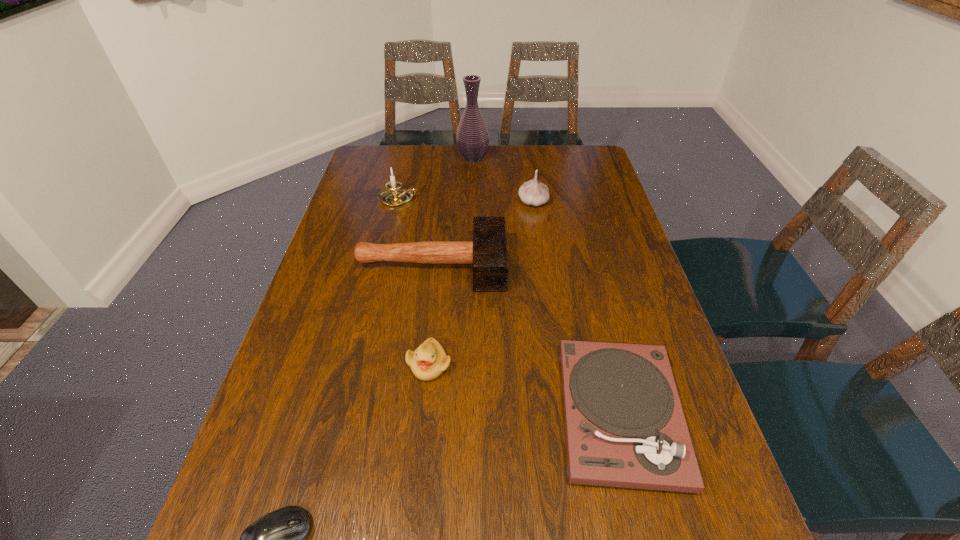
Identify the location of blank space located on the hammer head face of the mallet. (552, 265).

Find the location of `vacant space located on the front-facing side of the duckling`. vacant space located on the front-facing side of the duckling is located at coordinates (420, 446).

Locate an element on the screen. vacant area situated on the back of the phonograph_record is located at coordinates (586, 275).

Identify the location of object situated at the far edge. (472, 138).

The height and width of the screenshot is (540, 960). I want to click on candle holder that is at the left edge, so click(x=393, y=196).

Identify the location of mallet situated at the left edge. (488, 253).

This screenshot has width=960, height=540. Find the location of `object that is at the right edge`. object that is at the right edge is located at coordinates (625, 427).

The image size is (960, 540). In order to click on free space at the far edge in this screenshot , I will do `click(446, 150)`.

This screenshot has width=960, height=540. In order to click on blank space at the left edge in this screenshot , I will do `click(253, 476)`.

In the image, there is a desktop. At what (x,y) coordinates should I click in order to perform the action: click on vacant space at the right edge. Please return your answer as a coordinate pair (x, y). The height and width of the screenshot is (540, 960). Looking at the image, I should click on (603, 290).